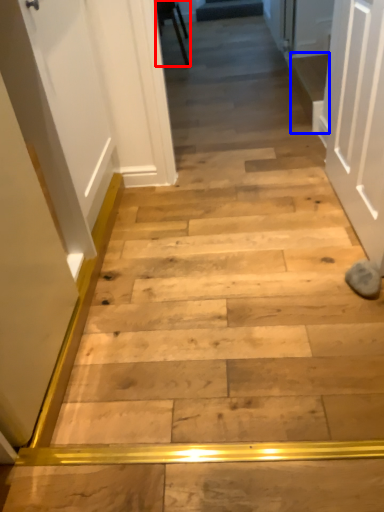
Question: Which point is closer to the camera, furniture (highlighted by a red box) or stairwell (highlighted by a blue box)?

Choices:
 (A) furniture
 (B) stairwell

Answer: (B)